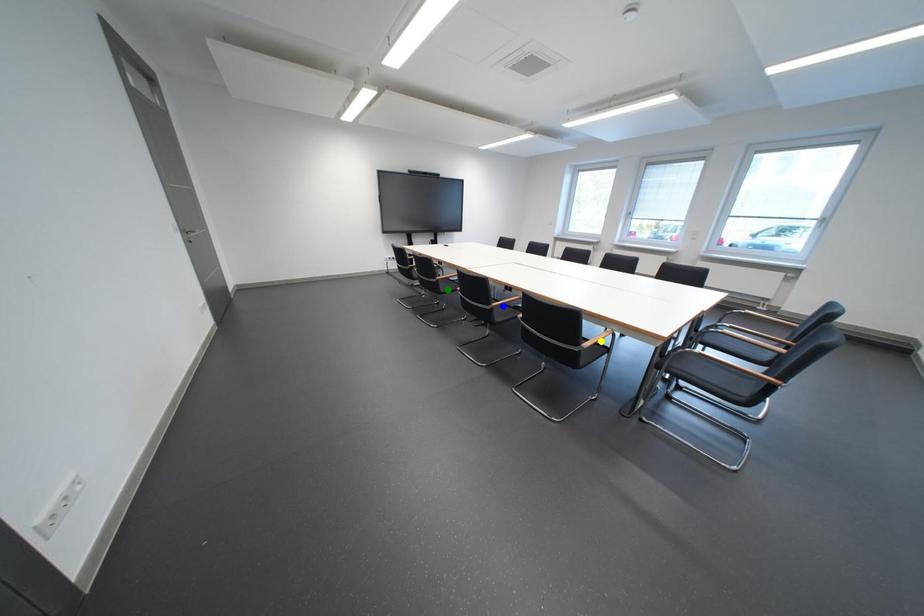
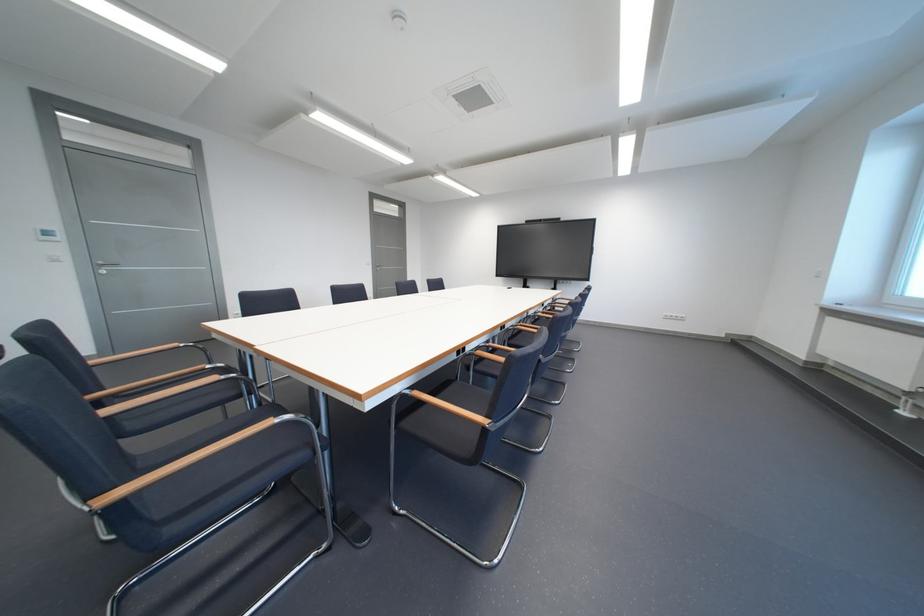
I am providing you with two images of the same scene from different viewpoints. Three points are marked in image1. Which point corresponds to a part or object that is occluded in image2?In image1, three points are marked. Which of them correspond to a part or object that is occluded in image2?Among the three points shown in image1, which one corresponds to a part or object that is no longer visible due to occlusion in image2?

Invisible in image2: yellow point, green point, blue point.